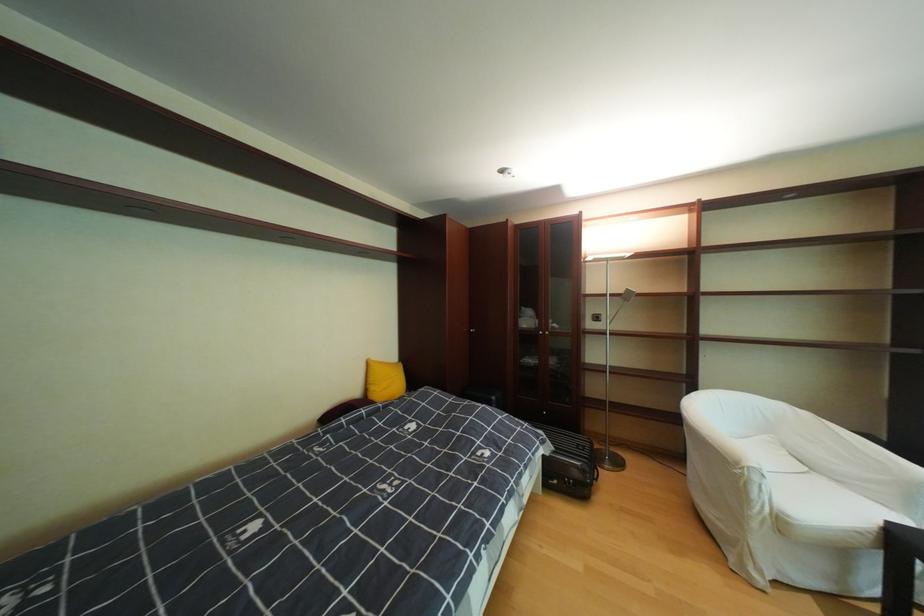
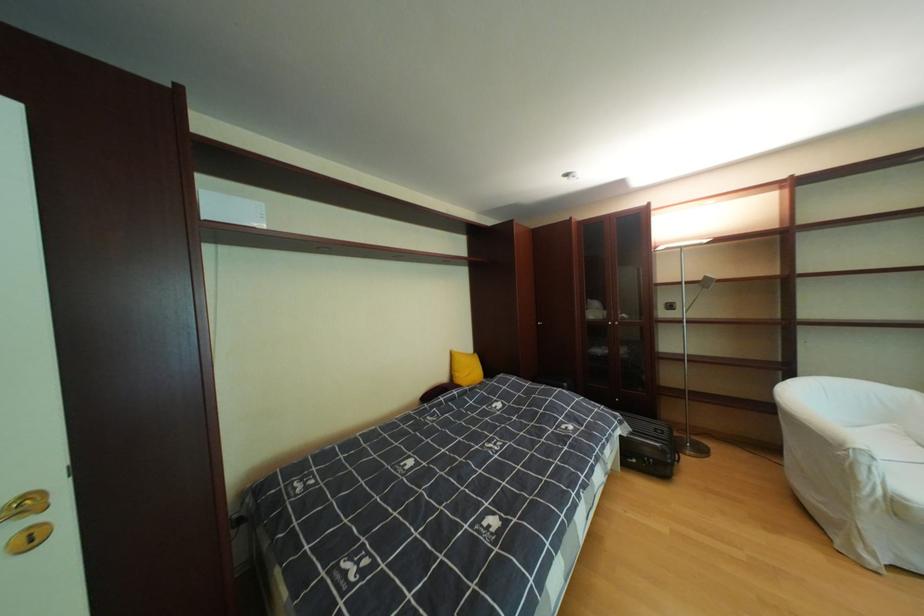
Where in the second image is the point corresponding to pixel 580 483 from the first image?

(661, 461)